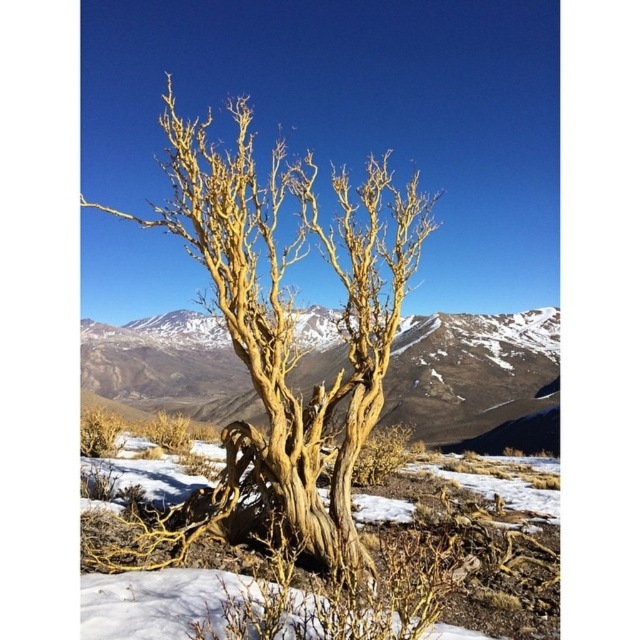
Question: Which of the following is the farthest from the observer?

Choices:
 (A) light brown bark tree at center
 (B) golden textured tree at center

Answer: (A)

Question: Is golden textured tree at center to the left of light brown bark tree at center from the viewer's perspective?

Choices:
 (A) no
 (B) yes

Answer: (A)

Question: Which object appears farthest from the camera in this image?

Choices:
 (A) light brown bark tree at center
 (B) golden textured tree at center

Answer: (A)

Question: Is the position of golden textured tree at center less distant than that of light brown bark tree at center?

Choices:
 (A) yes
 (B) no

Answer: (A)

Question: Does golden textured tree at center come behind light brown bark tree at center?

Choices:
 (A) yes
 (B) no

Answer: (B)